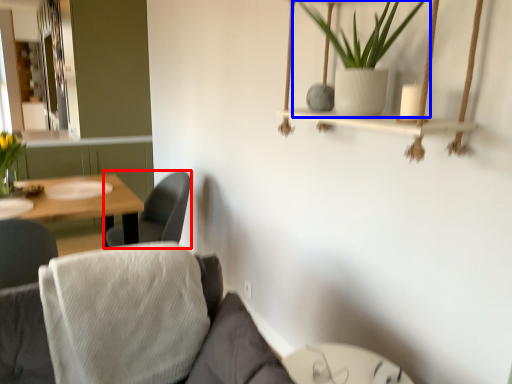
Question: Among these objects, which one is nearest to the camera, chair (highlighted by a red box) or houseplant (highlighted by a blue box)?

Choices:
 (A) chair
 (B) houseplant

Answer: (B)